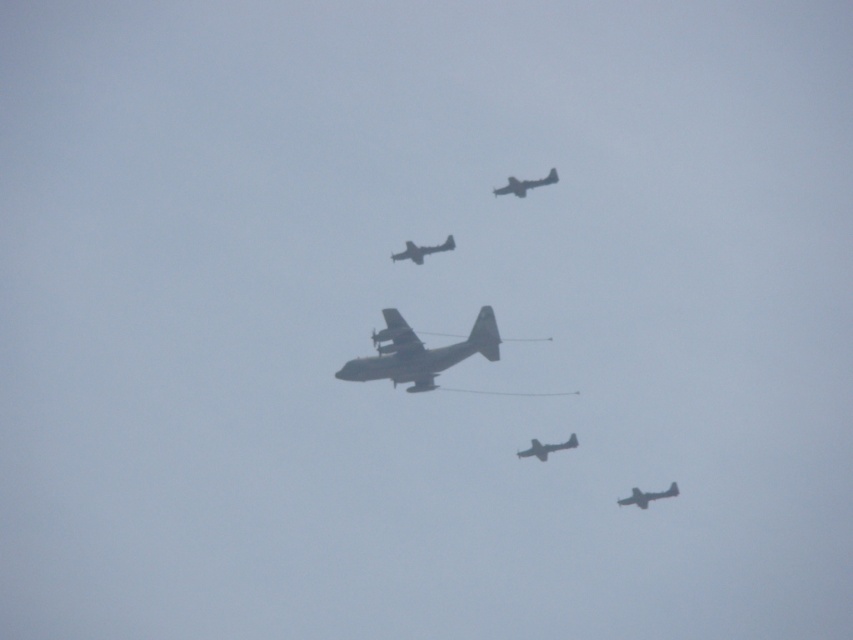
You are a GUI agent. You are given a task and a screenshot of the screen. Output one action in this format:
    pyautogui.click(x=<x>, y=<y>)
    Task: Click on the matte gray airplane at upper center
    
    Given the screenshot: What is the action you would take?
    pyautogui.click(x=525, y=184)

Identify the location of matte gray airplane at upper center. The height and width of the screenshot is (640, 853). (525, 184).

Is point (418, 253) behind point (498, 193)?

Yes, it is behind point (498, 193).

The height and width of the screenshot is (640, 853). In order to click on metallic gray airplane at center in this screenshot , I will do `click(422, 250)`.

Between point (433, 248) and point (498, 195), which one is positioned behind?

The point (498, 195) is behind.

Locate an element on the screen. metallic gray airplane at center is located at coordinates (422, 250).

Is gray matte cargo plane at center closer to camera compared to metallic gray airplane at lower right?

Yes, gray matte cargo plane at center is in front of metallic gray airplane at lower right.

Is point (397, 348) closer to viewer compared to point (660, 492)?

That is True.

Is point (370, 371) closer to camera compared to point (672, 490)?

That is True.

Find the location of a particular element. gray matte cargo plane at center is located at coordinates (419, 353).